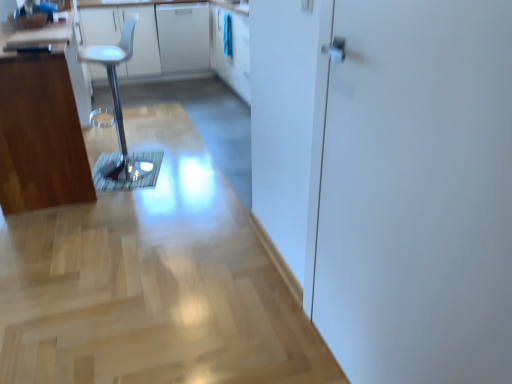
How much space does wooden cabinet at left, which appears as the 1th cabinetry when ordered from the bottom, occupy horizontally?

It is 22.34 inches.

I want to click on white glossy cabinet at upper center, positioned as the 2th cabinetry in front-to-back order, so click(183, 36).

I want to click on white plastic stool at left, so click(120, 122).

In the scene shown: Who is smaller, white glossy counter top at upper left or white glossy door at right?

white glossy door at right.

Locate an element on the screen. This screenshot has width=512, height=384. screen door on the right of white glossy counter top at upper left is located at coordinates (418, 193).

Based on the photo, is white glossy counter top at upper left far from white glossy door at right?

Yes, white glossy counter top at upper left and white glossy door at right are quite far apart.

Is white plastic stool at left positioned in front of white glossy cabinet at upper center, the 1th cabinetry from the back?

Yes, white plastic stool at left is closer to the viewer.

Considering the sizes of objects white plastic stool at left and white glossy cabinet at upper center, positioned as the 2th cabinetry in front-to-back order, in the image provided, who is bigger, white plastic stool at left or white glossy cabinet at upper center, positioned as the 2th cabinetry in front-to-back order,?

white glossy cabinet at upper center, positioned as the 2th cabinetry in front-to-back order.

Does white plastic stool at left appear on the right side of white glossy cabinet at upper center, the second cabinetry positioned from the bottom?

In fact, white plastic stool at left is to the left of white glossy cabinet at upper center, the second cabinetry positioned from the bottom.

Would you say white plastic stool at left is a long distance from white glossy cabinet at upper center, the 1th cabinetry from the back?

That's right, there is a large distance between white plastic stool at left and white glossy cabinet at upper center, the 1th cabinetry from the back.

Are white glossy cabinet at upper center, the second cabinetry positioned from the bottom, and wooden cabinet at left, which is the first cabinetry from front to back, located far from each other?

Indeed, white glossy cabinet at upper center, the second cabinetry positioned from the bottom, is not near wooden cabinet at left, which is the first cabinetry from front to back.

Choose the correct answer: Is white glossy cabinet at upper center, positioned as the 2th cabinetry in front-to-back order, inside wooden cabinet at left, which is the 2th cabinetry in top-to-bottom order, or outside it?

white glossy cabinet at upper center, positioned as the 2th cabinetry in front-to-back order, is not inside wooden cabinet at left, which is the 2th cabinetry in top-to-bottom order, it's outside.

Can you tell me how much white glossy cabinet at upper center, positioned as the 2th cabinetry in front-to-back order, and wooden cabinet at left, which is the first cabinetry from front to back, differ in facing direction?

90.1 degrees separate the facing orientations of white glossy cabinet at upper center, positioned as the 2th cabinetry in front-to-back order, and wooden cabinet at left, which is the first cabinetry from front to back.

Is white glossy cabinet at upper center, positioned as the 2th cabinetry in front-to-back order, shorter than wooden cabinet at left, which is the first cabinetry from front to back?

Correct, white glossy cabinet at upper center, positioned as the 2th cabinetry in front-to-back order, is not as tall as wooden cabinet at left, which is the first cabinetry from front to back.

The height and width of the screenshot is (384, 512). Identify the location of cabinetry that is under the white glossy counter top at upper left (from a real-world perspective). (183, 36).

Is white glossy cabinet at upper center, the second cabinetry positioned from the bottom, positioned before white glossy counter top at upper left?

No, it is not.

Can white glossy counter top at upper left be found inside white glossy cabinet at upper center, positioned as the 2th cabinetry in front-to-back order?

Yes, white glossy counter top at upper left is inside white glossy cabinet at upper center, positioned as the 2th cabinetry in front-to-back order.

From a real-world perspective, is white glossy cabinet at upper center, the second cabinetry positioned from the bottom, positioned above or below white glossy door at right?

In terms of real-world spatial position, white glossy cabinet at upper center, the second cabinetry positioned from the bottom, is below white glossy door at right.

Between white glossy cabinet at upper center, the second cabinetry positioned from the bottom, and white glossy door at right, which one has smaller size?

With smaller size is white glossy door at right.

Who is shorter, white glossy cabinet at upper center, the second cabinetry positioned from the bottom, or white glossy door at right?

Standing shorter between the two is white glossy cabinet at upper center, the second cabinetry positioned from the bottom.

Identify the location of cabinetry above the white glossy cabinet at upper center, the 1th cabinetry from the back (from a real-world perspective). The width and height of the screenshot is (512, 384). (42, 124).

Is wooden cabinet at left, which is the 2th cabinetry in top-to-bottom order, next to white glossy cabinet at upper center, the first cabinetry viewed from the top?

wooden cabinet at left, which is the 2th cabinetry in top-to-bottom order, is not next to white glossy cabinet at upper center, the first cabinetry viewed from the top, and they're not touching.

Considering the sizes of objects wooden cabinet at left, the second cabinetry when ordered from back to front, and white glossy cabinet at upper center, the first cabinetry viewed from the top, in the image provided, who is smaller, wooden cabinet at left, the second cabinetry when ordered from back to front, or white glossy cabinet at upper center, the first cabinetry viewed from the top,?

white glossy cabinet at upper center, the first cabinetry viewed from the top.

In terms of width, does white glossy counter top at upper left look wider or thinner when compared to wooden cabinet at left, which appears as the 1th cabinetry when ordered from the bottom?

white glossy counter top at upper left is wider than wooden cabinet at left, which appears as the 1th cabinetry when ordered from the bottom.

Is wooden cabinet at left, the second cabinetry when ordered from back to front, at the back of white glossy counter top at upper left?

No, white glossy counter top at upper left is not facing the opposite direction of wooden cabinet at left, the second cabinetry when ordered from back to front.

Is white glossy counter top at upper left next to wooden cabinet at left, the second cabinetry when ordered from back to front?

white glossy counter top at upper left is not next to wooden cabinet at left, the second cabinetry when ordered from back to front, and they're not touching.

At what (x,y) coordinates should I click in order to perform the action: click on counter top behind the white glossy door at right. Please return your answer as a coordinate pair (x, y). The height and width of the screenshot is (384, 512). Looking at the image, I should click on (152, 35).

Identify the location of cabinetry that is the 2nd object directly below the white plastic stool at left (from a real-world perspective). (183, 36).

When comparing their distances from white glossy cabinet at upper center, positioned as the 2th cabinetry in front-to-back order, does white glossy door at right or white plastic stool at left seem closer?

white plastic stool at left.

When comparing their distances from wooden cabinet at left, which is the first cabinetry from front to back, does white glossy door at right or white glossy counter top at upper left seem further?

Based on the image, white glossy counter top at upper left appears to be further to wooden cabinet at left, which is the first cabinetry from front to back.

Estimate the real-world distances between objects in this image. Which object is further from white plastic stool at left, white glossy counter top at upper left or wooden cabinet at left, which is the first cabinetry from front to back?

Based on the image, white glossy counter top at upper left appears to be further to white plastic stool at left.

When comparing their distances from white plastic stool at left, does wooden cabinet at left, which is the 2th cabinetry in top-to-bottom order, or white glossy door at right seem closer?

Based on the image, wooden cabinet at left, which is the 2th cabinetry in top-to-bottom order, appears to be nearer to white plastic stool at left.

Looking at this image, when comparing their distances from white glossy door at right, does white plastic stool at left or white glossy cabinet at upper center, the first cabinetry viewed from the top, seem further?

white glossy cabinet at upper center, the first cabinetry viewed from the top.

Which object lies nearer to the anchor point white glossy cabinet at upper center, the first cabinetry viewed from the top, white plastic stool at left or white glossy counter top at upper left?

Based on the image, white glossy counter top at upper left appears to be nearer to white glossy cabinet at upper center, the first cabinetry viewed from the top.

When comparing their distances from wooden cabinet at left, which appears as the 1th cabinetry when ordered from the bottom, does white plastic stool at left or white glossy counter top at upper left seem further?

white glossy counter top at upper left is positioned further to the anchor wooden cabinet at left, which appears as the 1th cabinetry when ordered from the bottom.

When comparing their distances from white glossy counter top at upper left, does wooden cabinet at left, the second cabinetry when ordered from back to front, or white glossy door at right seem further?

Based on the image, white glossy door at right appears to be further to white glossy counter top at upper left.

Image resolution: width=512 pixels, height=384 pixels. I want to click on cabinetry between white glossy door at right and white plastic stool at left from front to back, so click(42, 124).

Find the location of a particular element. This screenshot has width=512, height=384. counter top between wooden cabinet at left, which is the first cabinetry from front to back, and white glossy cabinet at upper center, the 1th cabinetry from the back, from front to back is located at coordinates tap(152, 35).

At what (x,y) coordinates should I click in order to perform the action: click on step stool between wooden cabinet at left, which is the 2th cabinetry in top-to-bottom order, and white glossy cabinet at upper center, the second cabinetry positioned from the bottom, along the z-axis. Please return your answer as a coordinate pair (x, y). Looking at the image, I should click on (120, 122).

You are a GUI agent. You are given a task and a screenshot of the screen. Output one action in this format:
    pyautogui.click(x=<x>, y=<y>)
    Task: Click on the step stool between white glossy door at right and white glossy counter top at upper left in the front-back direction
    The height and width of the screenshot is (384, 512).
    Given the screenshot: What is the action you would take?
    pyautogui.click(x=120, y=122)